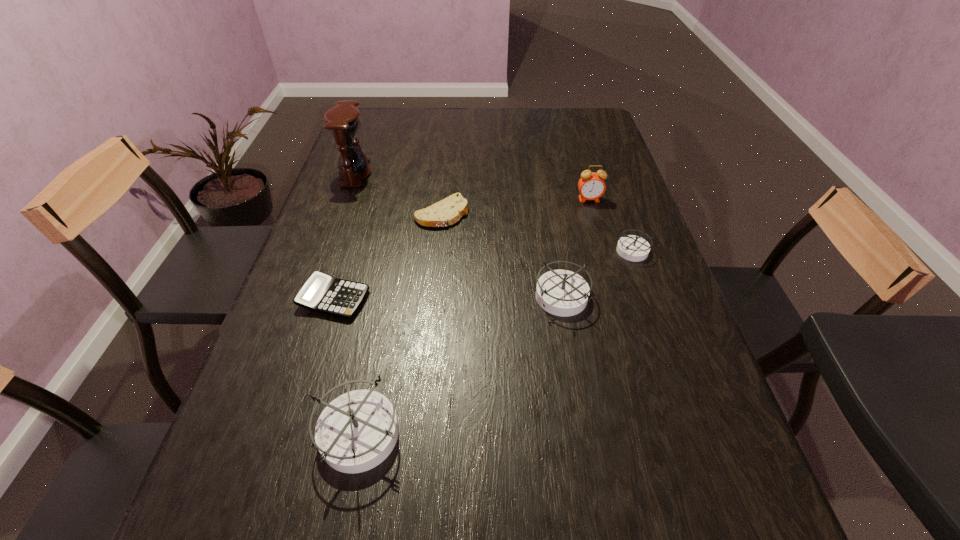
Locate an element on the screen. Image resolution: width=960 pixels, height=540 pixels. calculator located at the left edge is located at coordinates (321, 293).

The width and height of the screenshot is (960, 540). What are the coordinates of `hourglass that is at the left edge` in the screenshot? It's located at click(x=343, y=121).

Where is `compass that is positioned at the right edge`? The width and height of the screenshot is (960, 540). compass that is positioned at the right edge is located at coordinates (634, 248).

Locate an element on the screen. The width and height of the screenshot is (960, 540). alarm clock that is at the right edge is located at coordinates (591, 185).

Locate an element on the screen. The height and width of the screenshot is (540, 960). object positioned at the near left corner is located at coordinates (357, 431).

In the image, there is a desktop. At what (x,y) coordinates should I click in order to perform the action: click on free space at the far edge. Please return your answer as a coordinate pair (x, y). Looking at the image, I should click on (412, 111).

Where is `vacant space at the near edge`? vacant space at the near edge is located at coordinates (435, 461).

The image size is (960, 540). What are the coordinates of `free space at the left edge of the desktop` in the screenshot? It's located at (334, 329).

This screenshot has height=540, width=960. In the image, there is a desktop. Find the location of `free space at the right edge`. free space at the right edge is located at coordinates (564, 141).

The image size is (960, 540). Find the location of `free space at the far right corner of the desktop`. free space at the far right corner of the desktop is located at coordinates (584, 109).